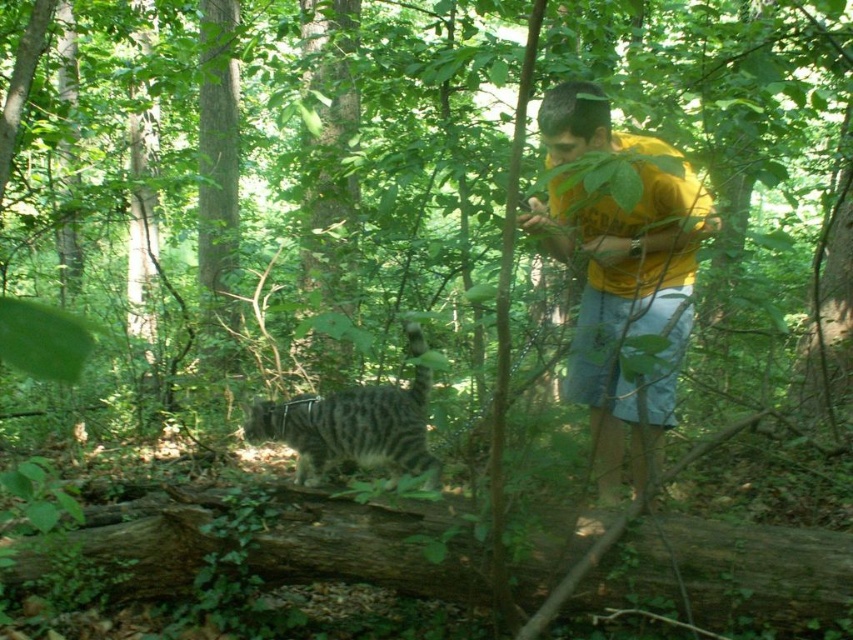
You are a hiker who wants to place a GPS tracker on the brown rough log at lower center. The GPS tracker requires coordinates to be set in the format of two decimal numbers between 0 and 1. What coordinates should you input?

The coordinates for the brown rough log at lower center are 0.894 and 0.851, so you should input 0.89 and 0.85 respectively as the GPS tracker requires two decimal numbers between 0 and 1.

You are a hiker who wants to sit on the brown rough log at lower center. You are currently standing near the yellow cotton shirt at center. Can you sit down without moving your feet? Explain your reasoning.

The distance between the brown rough log at lower center and the yellow cotton shirt at center is 37.29 inches. Since the hiker is standing near the yellow cotton shirt at center, they can likely sit on the log without moving their feet as the distance is within a comfortable reach for sitting down.

You are a hiker who wants to place a small backpack between the brown rough log at lower center and the striped fur cat at center. Can you do this without moving either object?

The brown rough log at lower center is positioned under the striped fur cat at center, so there is no space between them to place the backpack.